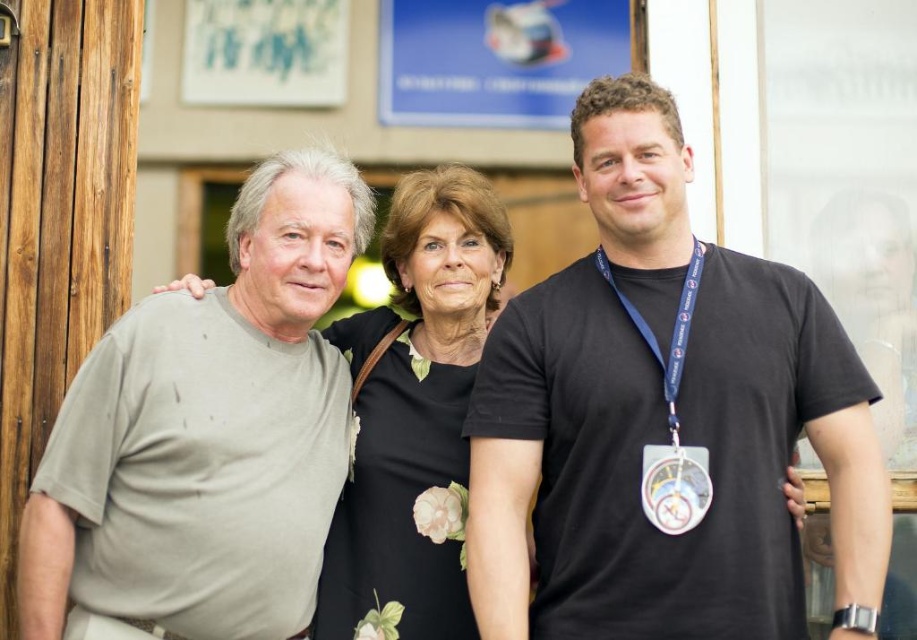
Who is positioned more to the left, black floral dress at center or metallic circular badge at center-right?

black floral dress at center

Can you confirm if black floral dress at center is thinner than metallic circular badge at center-right?

In fact, black floral dress at center might be wider than metallic circular badge at center-right.

Does point (467, 472) lie in front of point (697, 464)?

No, it is behind (697, 464).

Where is `black floral dress at center`? black floral dress at center is located at coordinates (418, 410).

Is black matte t-shirt at right closer to the viewer compared to matte khaki t-shirt at left?

That is True.

Who is more forward, (841, 481) or (286, 584)?

Point (841, 481)

Locate an element on the screen. black matte t-shirt at right is located at coordinates (663, 419).

How distant is matte khaki t-shirt at left from metallic circular badge at center-right?

The distance of matte khaki t-shirt at left from metallic circular badge at center-right is 7.78 meters.

Consider the image. Can you confirm if matte khaki t-shirt at left is positioned to the right of metallic circular badge at center-right?

In fact, matte khaki t-shirt at left is to the left of metallic circular badge at center-right.

This screenshot has width=917, height=640. What do you see at coordinates (208, 432) in the screenshot?
I see `matte khaki t-shirt at left` at bounding box center [208, 432].

Find the location of a particular element. The image size is (917, 640). matte khaki t-shirt at left is located at coordinates tap(208, 432).